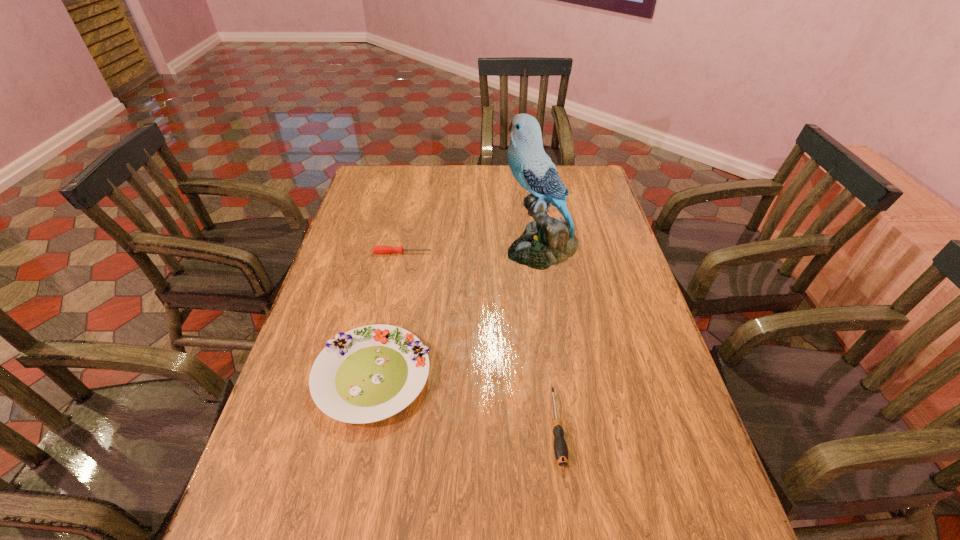
The width and height of the screenshot is (960, 540). In order to click on free spot that satisfies the following two spatial constraints: 1. at the tip of the left screwdriver; 2. on the front side of the third shortest object in this screenshot , I will do `click(377, 376)`.

Find the location of a particular element. Image resolution: width=960 pixels, height=540 pixels. free spot that satisfies the following two spatial constraints: 1. at the tip of the left screwdriver; 2. on the front side of the third shortest object is located at coordinates click(x=377, y=376).

Where is `blank area in the image that satisfies the following two spatial constraints: 1. at the tip of the shortest object; 2. on the back side of the third tallest object`? This screenshot has height=540, width=960. blank area in the image that satisfies the following two spatial constraints: 1. at the tip of the shortest object; 2. on the back side of the third tallest object is located at coordinates coord(368,427).